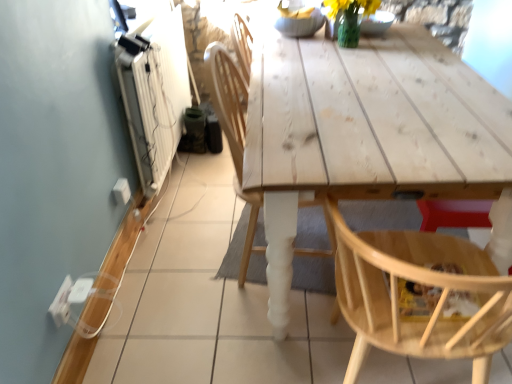
Question: Considering the relative sizes of natural wood chair at lower right, placed as the 1th chair when sorted from right to left, and white plastic electric outlet at lower left, arranged as the 2th electric outlet when viewed from the front, in the image provided, is natural wood chair at lower right, placed as the 1th chair when sorted from right to left, bigger than white plastic electric outlet at lower left, arranged as the 2th electric outlet when viewed from the front,?

Choices:
 (A) no
 (B) yes

Answer: (B)

Question: Is natural wood chair at lower right, placed as the 1th chair when sorted from right to left, smaller than white plastic electric outlet at lower left, acting as the 1th electric outlet starting from the back?

Choices:
 (A) yes
 (B) no

Answer: (B)

Question: Does natural wood chair at lower right, placed as the 1th chair when sorted from right to left, have a greater width compared to white plastic electric outlet at lower left, the first electric outlet when ordered from top to bottom?

Choices:
 (A) no
 (B) yes

Answer: (B)

Question: Is natural wood chair at lower right, the second chair positioned from the left, shorter than white plastic electric outlet at lower left, arranged as the 2th electric outlet when viewed from the front?

Choices:
 (A) no
 (B) yes

Answer: (A)

Question: Is the position of natural wood chair at lower right, the second chair positioned from the left, less distant than that of white plastic electric outlet at lower left, acting as the 1th electric outlet starting from the back?

Choices:
 (A) yes
 (B) no

Answer: (A)

Question: From a real-world perspective, is natural wood chair at lower right, placed as the 1th chair when sorted from right to left, over white plastic electric outlet at lower left, placed as the second electric outlet when sorted from bottom to top?

Choices:
 (A) no
 (B) yes

Answer: (B)

Question: Is white plastic electric outlet at lower left, placed as the first electric outlet when sorted from bottom to top, smaller than white plastic electric outlet at lower left, arranged as the 2th electric outlet when viewed from the front?

Choices:
 (A) no
 (B) yes

Answer: (B)

Question: Would you say white plastic electric outlet at lower left, arranged as the first electric outlet when viewed from the right, is part of white plastic electric outlet at lower left, placed as the first electric outlet when sorted from bottom to top,'s contents?

Choices:
 (A) yes
 (B) no

Answer: (B)

Question: Is white plastic electric outlet at lower left, the 2th electric outlet viewed from the right, not close to white plastic electric outlet at lower left, placed as the second electric outlet when sorted from bottom to top?

Choices:
 (A) yes
 (B) no

Answer: (B)

Question: Is white plastic electric outlet at lower left, marked as the 1th electric outlet in a front-to-back arrangement, behind white plastic electric outlet at lower left, arranged as the 2th electric outlet when viewed from the front?

Choices:
 (A) no
 (B) yes

Answer: (A)

Question: From the image's perspective, is white plastic electric outlet at lower left, marked as the 1th electric outlet in a front-to-back arrangement, beneath white plastic electric outlet at lower left, which is the second electric outlet in left-to-right order?

Choices:
 (A) yes
 (B) no

Answer: (A)

Question: From a real-world perspective, is white plastic electric outlet at lower left, the 2th electric outlet viewed from the right, on white plastic electric outlet at lower left, the first electric outlet when ordered from top to bottom?

Choices:
 (A) yes
 (B) no

Answer: (A)

Question: Does white plastic electric outlet at lower left, arranged as the 2th electric outlet when viewed from the front, have a greater width compared to wooden chair at center, the 2th chair when ordered from right to left?

Choices:
 (A) yes
 (B) no

Answer: (B)